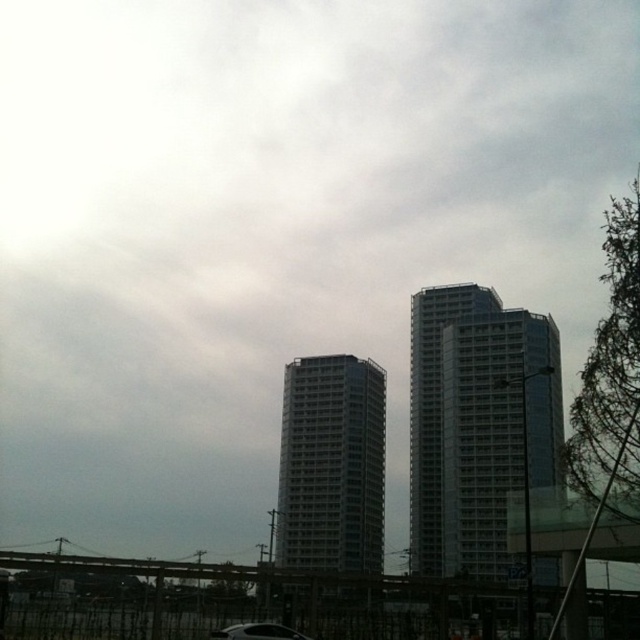
Between gray concrete building at center and black glossy car at lower center, which one has more height?

Standing taller between the two is gray concrete building at center.

Is point (340, 400) more distant than point (252, 625)?

Yes.

Which is in front, point (340, 484) or point (253, 636)?

Positioned in front is point (253, 636).

At what (x,y) coordinates should I click in order to perform the action: click on gray concrete building at center. Please return your answer as a coordinate pair (x, y). The height and width of the screenshot is (640, 640). Looking at the image, I should click on (332, 465).

Looking at this image, is glassy silver building at right taller than black glossy car at lower center?

Correct, glassy silver building at right is much taller as black glossy car at lower center.

Is glassy silver building at right further to the viewer compared to black glossy car at lower center?

No, glassy silver building at right is closer to the viewer.

Where is `glassy silver building at right`? The height and width of the screenshot is (640, 640). glassy silver building at right is located at coordinates (476, 426).

Which is in front, point (461, 353) or point (291, 564)?

Point (461, 353)

Which is above, glassy silver building at right or gray concrete building at center?

glassy silver building at right is higher up.

Does point (504, 364) lie behind point (307, 480)?

No, it is not.

You are a GUI agent. You are given a task and a screenshot of the screen. Output one action in this format:
    pyautogui.click(x=<x>, y=<y>)
    Task: Click on the glassy silver building at right
    The width and height of the screenshot is (640, 640).
    Given the screenshot: What is the action you would take?
    pyautogui.click(x=476, y=426)